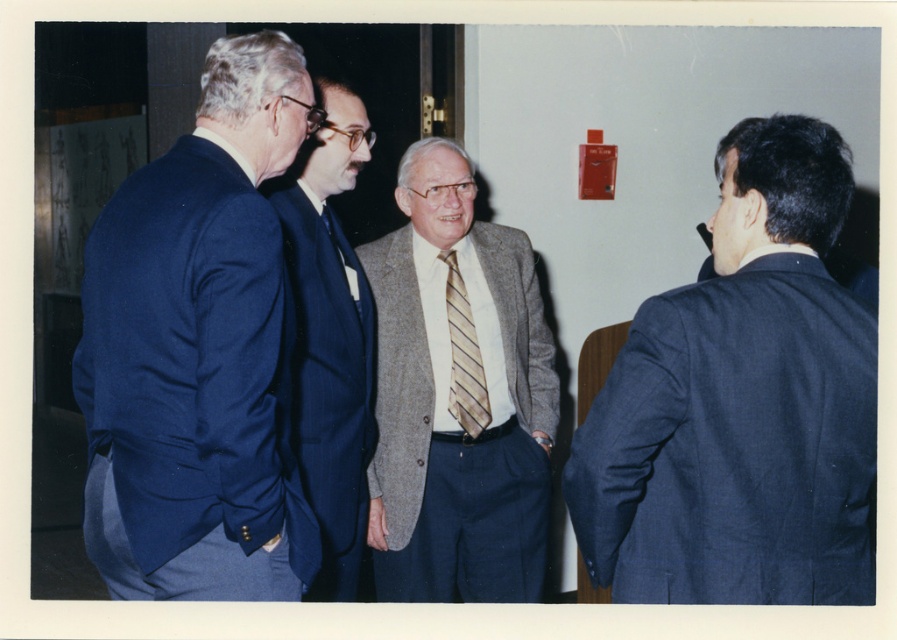
Is gray textured blazer at center below striped silk tie at center?

Yes, gray textured blazer at center is below striped silk tie at center.

Does gray textured blazer at center have a greater width compared to striped silk tie at center?

Yes.

The width and height of the screenshot is (897, 640). In order to click on gray textured blazer at center in this screenshot , I will do `click(457, 396)`.

At what (x,y) coordinates should I click in order to perform the action: click on gray textured blazer at center. Please return your answer as a coordinate pair (x, y). This screenshot has height=640, width=897. Looking at the image, I should click on (457, 396).

Does point (803, 416) come farther from viewer compared to point (218, 540)?

That is False.

Between point (588, 522) and point (262, 212), which one is positioned in front?

Point (588, 522) is more forward.

Locate an element on the screen. dark blue suit at right is located at coordinates (742, 404).

Is blue wool suit at center bigger than striped silk tie at center?

Correct, blue wool suit at center is larger in size than striped silk tie at center.

What do you see at coordinates (329, 337) in the screenshot? I see `blue wool suit at center` at bounding box center [329, 337].

Where is `blue wool suit at center`? This screenshot has height=640, width=897. blue wool suit at center is located at coordinates (329, 337).